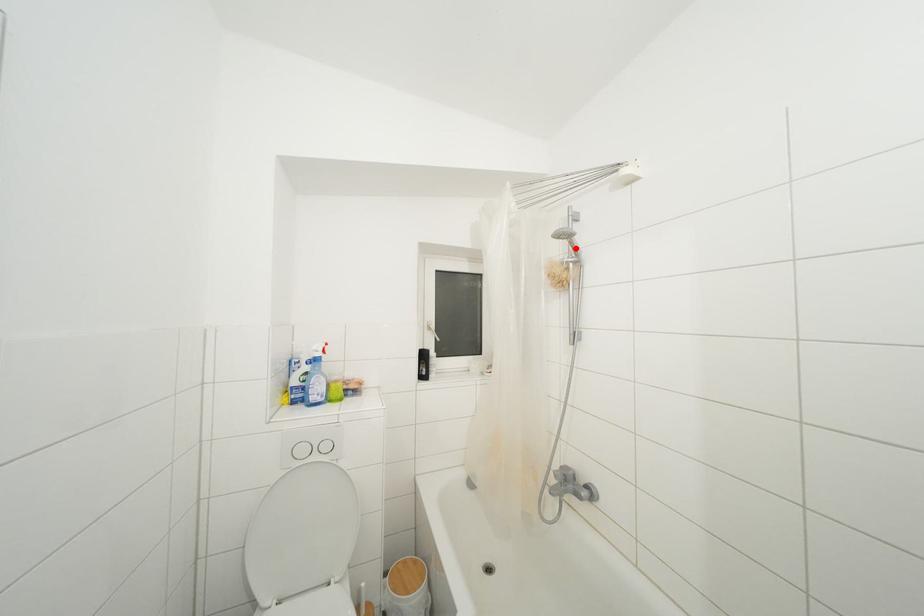
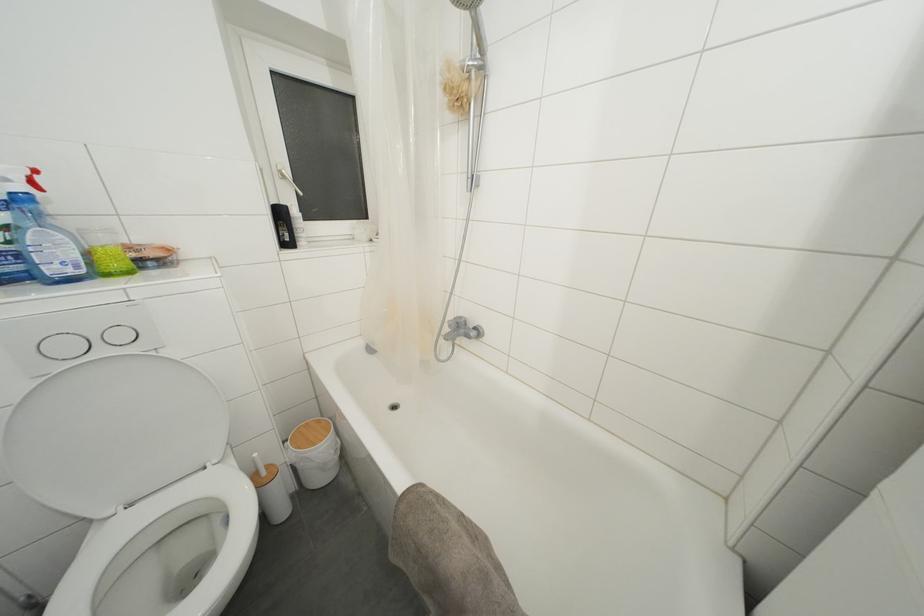
Question: I am providing you with two images of the same scene from different viewpoints. A red point is marked on the first image. At the location where the point appears in image 1, is it still visible in image 2?

Choices:
 (A) Yes
 (B) No

Answer: (A)